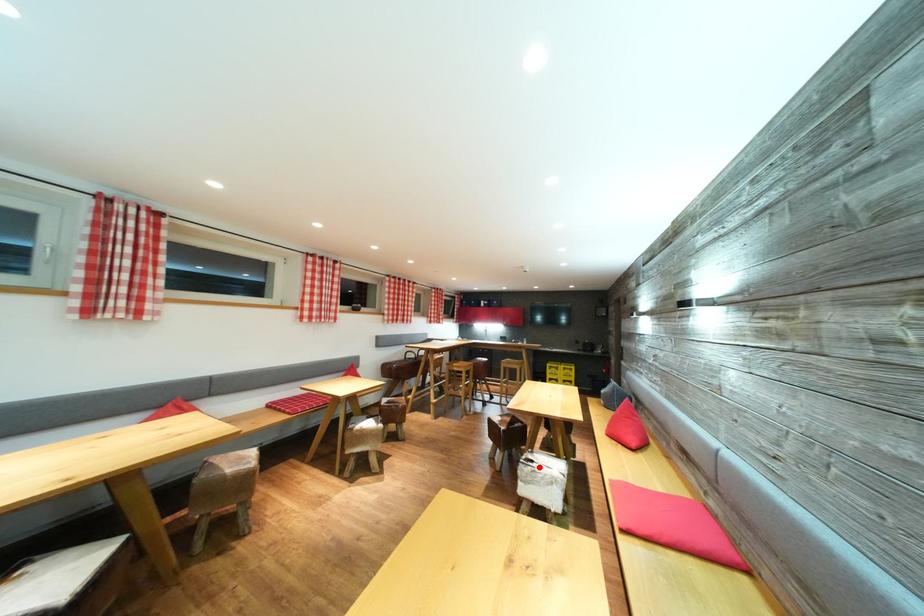
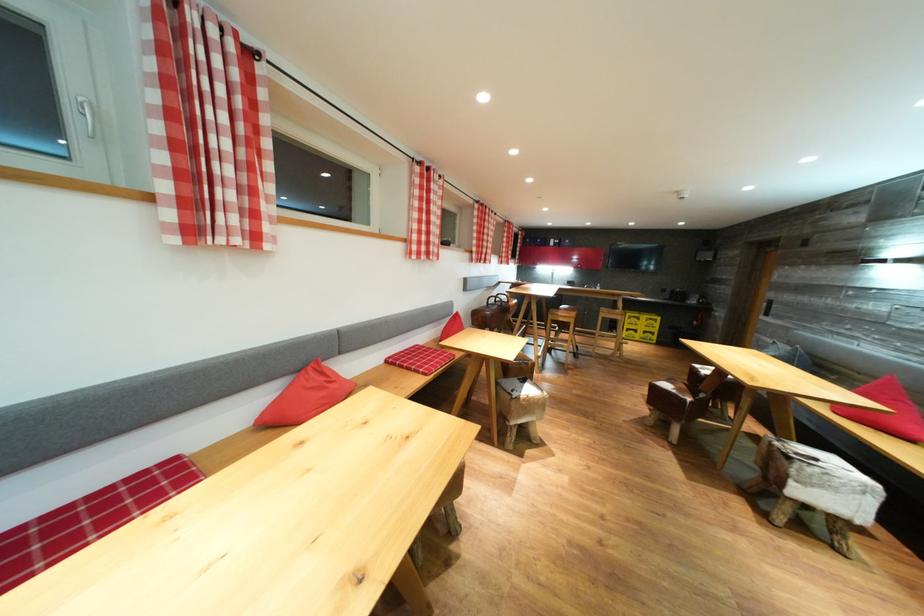
Question: I am providing you with two images of the same scene from different viewpoints. Image1 has a red point marked. In image2, the corresponding 3D location appears at what relative position? Reply with the corresponding letter.

Choices:
 (A) Closer
 (B) Farther

Answer: (B)